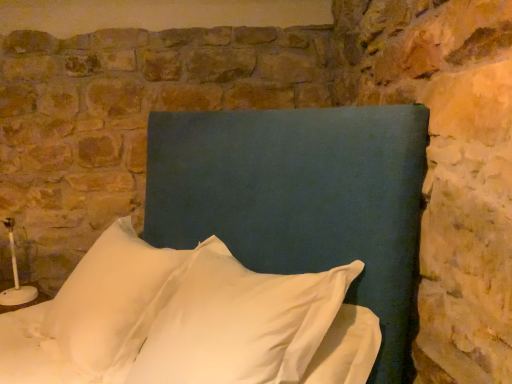
At what (x,y) coordinates should I click in order to perform the action: click on matte blue headboard at center. Please return your answer as a coordinate pair (x, y). The image size is (512, 384). Looking at the image, I should click on (298, 195).

Image resolution: width=512 pixels, height=384 pixels. What do you see at coordinates (112, 301) in the screenshot?
I see `white soft pillow at center, positioned as the 2th pillow in right-to-left order` at bounding box center [112, 301].

Describe the element at coordinates (244, 324) in the screenshot. Image resolution: width=512 pixels, height=384 pixels. I see `white fabric pillow at center, which is the first pillow in right-to-left order` at that location.

How much space does white fabric pillow at center, the second pillow in the left-to-right sequence, occupy horizontally?

15.92 inches.

Find the location of a particular element. This screenshot has height=384, width=512. matte blue headboard at center is located at coordinates (298, 195).

Is matte blue headboard at center far away from white fabric pillow at center, the second pillow in the left-to-right sequence?

They are positioned close to each other.

From a real-world perspective, is matte blue headboard at center on top of white fabric pillow at center, the second pillow in the left-to-right sequence?

Yes, from a real-world perspective, matte blue headboard at center is above white fabric pillow at center, the second pillow in the left-to-right sequence.

From the image's perspective, is matte blue headboard at center located above or below white fabric pillow at center, the second pillow in the left-to-right sequence?

matte blue headboard at center is situated higher than white fabric pillow at center, the second pillow in the left-to-right sequence, in the image.

Would you say matte blue headboard at center is inside or outside white fabric pillow at center, the second pillow in the left-to-right sequence?

matte blue headboard at center fits inside white fabric pillow at center, the second pillow in the left-to-right sequence.

Do you think white fabric pillow at center, the second pillow in the left-to-right sequence, is within white soft pillow at center, positioned as the 2th pillow in right-to-left order, or outside of it?

white fabric pillow at center, the second pillow in the left-to-right sequence, is outside white soft pillow at center, positioned as the 2th pillow in right-to-left order.

Is white fabric pillow at center, which is the first pillow in right-to-left order, next to white soft pillow at center, acting as the 1th pillow starting from the left?

No, white fabric pillow at center, which is the first pillow in right-to-left order, is not beside white soft pillow at center, acting as the 1th pillow starting from the left.

Visually, is white fabric pillow at center, which is the first pillow in right-to-left order, positioned to the left or to the right of white soft pillow at center, acting as the 1th pillow starting from the left?

Clearly, white fabric pillow at center, which is the first pillow in right-to-left order, is on the right of white soft pillow at center, acting as the 1th pillow starting from the left, in the image.

Is white fabric pillow at center, the second pillow in the left-to-right sequence, taller or shorter than matte blue headboard at center?

Considering their sizes, white fabric pillow at center, the second pillow in the left-to-right sequence, has less height than matte blue headboard at center.

Could you tell me if white fabric pillow at center, which is the first pillow in right-to-left order, is turned towards matte blue headboard at center?

Yes, white fabric pillow at center, which is the first pillow in right-to-left order, faces towards matte blue headboard at center.

Consider the image. From a real-world perspective, between white fabric pillow at center, the second pillow in the left-to-right sequence, and matte blue headboard at center, who is vertically lower?

In real-world perspective, white fabric pillow at center, the second pillow in the left-to-right sequence, is lower.

Can you confirm if white fabric pillow at center, which is the first pillow in right-to-left order, is thinner than matte blue headboard at center?

Yes, white fabric pillow at center, which is the first pillow in right-to-left order, is thinner than matte blue headboard at center.

Who is bigger, white soft pillow at center, positioned as the 2th pillow in right-to-left order, or matte blue headboard at center?

With larger size is matte blue headboard at center.

Can you tell me how much white soft pillow at center, positioned as the 2th pillow in right-to-left order, and matte blue headboard at center differ in facing direction?

They differ by 5.99 degrees in their facing directions.

From a real-world perspective, relative to matte blue headboard at center, is white soft pillow at center, acting as the 1th pillow starting from the left, vertically above or below?

In terms of real-world spatial position, white soft pillow at center, acting as the 1th pillow starting from the left, is below matte blue headboard at center.

Consider the image. Is white soft pillow at center, positioned as the 2th pillow in right-to-left order, oriented towards matte blue headboard at center?

No, white soft pillow at center, positioned as the 2th pillow in right-to-left order, is not turned towards matte blue headboard at center.

Considering the relative sizes of white soft pillow at center, acting as the 1th pillow starting from the left, and white fabric pillow at center, the second pillow in the left-to-right sequence, in the image provided, is white soft pillow at center, acting as the 1th pillow starting from the left, shorter than white fabric pillow at center, the second pillow in the left-to-right sequence,?

No.

Is point (150, 299) positioned behind point (362, 378)?

Yes.

Which is more to the left, white soft pillow at center, positioned as the 2th pillow in right-to-left order, or white fabric pillow at center, which is the first pillow in right-to-left order?

Result: Positioned to the left is white soft pillow at center, positioned as the 2th pillow in right-to-left order.

Considering the sizes of objects white soft pillow at center, acting as the 1th pillow starting from the left, and white fabric pillow at center, which is the first pillow in right-to-left order, in the image provided, who is thinner, white soft pillow at center, acting as the 1th pillow starting from the left, or white fabric pillow at center, which is the first pillow in right-to-left order,?

white fabric pillow at center, which is the first pillow in right-to-left order, is thinner.

From a real-world perspective, is matte blue headboard at center above or below white soft pillow at center, acting as the 1th pillow starting from the left?

matte blue headboard at center is above white soft pillow at center, acting as the 1th pillow starting from the left.

Is matte blue headboard at center oriented away from white soft pillow at center, acting as the 1th pillow starting from the left?

No, matte blue headboard at center's orientation is not away from white soft pillow at center, acting as the 1th pillow starting from the left.

From the image's perspective, is matte blue headboard at center positioned above or below white soft pillow at center, positioned as the 2th pillow in right-to-left order?

Clearly, from the image's perspective, matte blue headboard at center is above white soft pillow at center, positioned as the 2th pillow in right-to-left order.

Is matte blue headboard at center next to white soft pillow at center, positioned as the 2th pillow in right-to-left order?

No, matte blue headboard at center is not beside white soft pillow at center, positioned as the 2th pillow in right-to-left order.

This screenshot has height=384, width=512. In order to click on bed that appears on the left of white fabric pillow at center, which is the first pillow in right-to-left order in this screenshot , I will do `click(298, 195)`.

Locate an element on the screen. pillow below the white soft pillow at center, acting as the 1th pillow starting from the left (from the image's perspective) is located at coordinates (244, 324).

Considering their positions, is white fabric pillow at center, the second pillow in the left-to-right sequence, positioned further to white soft pillow at center, positioned as the 2th pillow in right-to-left order, than matte blue headboard at center?

The object further to white soft pillow at center, positioned as the 2th pillow in right-to-left order, is matte blue headboard at center.

Which object lies nearer to the anchor point matte blue headboard at center, white fabric pillow at center, which is the first pillow in right-to-left order, or white soft pillow at center, positioned as the 2th pillow in right-to-left order?

The object closer to matte blue headboard at center is white fabric pillow at center, which is the first pillow in right-to-left order.

Estimate the real-world distances between objects in this image. Which object is further from matte blue headboard at center, white soft pillow at center, positioned as the 2th pillow in right-to-left order, or white fabric pillow at center, the second pillow in the left-to-right sequence?

white soft pillow at center, positioned as the 2th pillow in right-to-left order, lies further to matte blue headboard at center than the other object.

From the image, which object appears to be farther from white fabric pillow at center, which is the first pillow in right-to-left order, matte blue headboard at center or white soft pillow at center, acting as the 1th pillow starting from the left?

white soft pillow at center, acting as the 1th pillow starting from the left, lies further to white fabric pillow at center, which is the first pillow in right-to-left order, than the other object.

Estimate the real-world distances between objects in this image. Which object is further from white fabric pillow at center, which is the first pillow in right-to-left order, white soft pillow at center, acting as the 1th pillow starting from the left, or matte blue headboard at center?

The object further to white fabric pillow at center, which is the first pillow in right-to-left order, is white soft pillow at center, acting as the 1th pillow starting from the left.

Looking at the image, which one is located further to white soft pillow at center, positioned as the 2th pillow in right-to-left order, matte blue headboard at center or white fabric pillow at center, which is the first pillow in right-to-left order?

matte blue headboard at center is further to white soft pillow at center, positioned as the 2th pillow in right-to-left order.

Image resolution: width=512 pixels, height=384 pixels. I want to click on pillow positioned between matte blue headboard at center and white soft pillow at center, positioned as the 2th pillow in right-to-left order, from near to far, so click(244, 324).